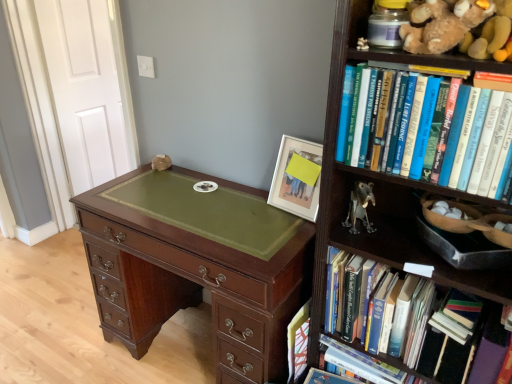
Where is `vacant space in front of matte wooden picture frame at upper center`? The image size is (512, 384). vacant space in front of matte wooden picture frame at upper center is located at coordinates (288, 225).